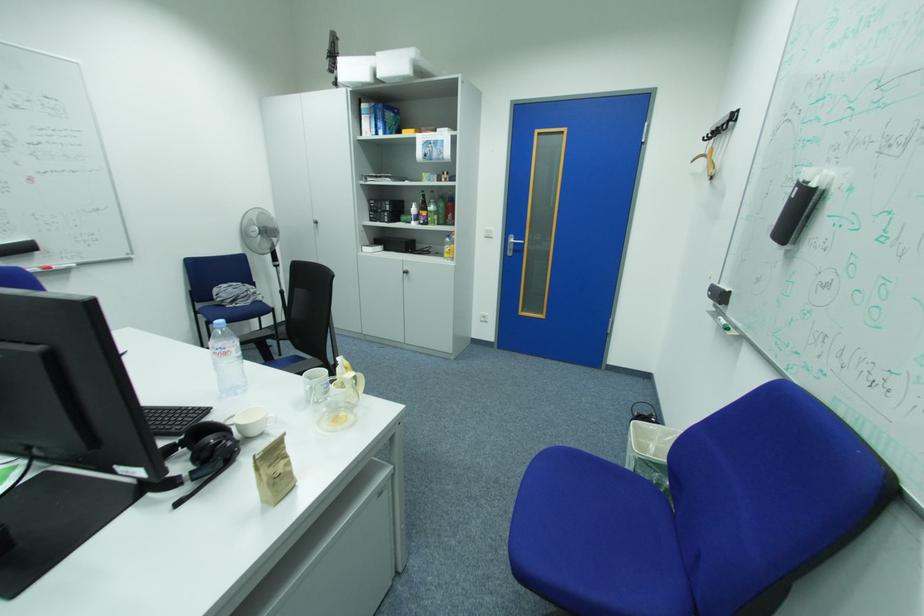
Find where to lift the black headphones. Please return your answer as a coordinate pair (x, y).

(199, 456)